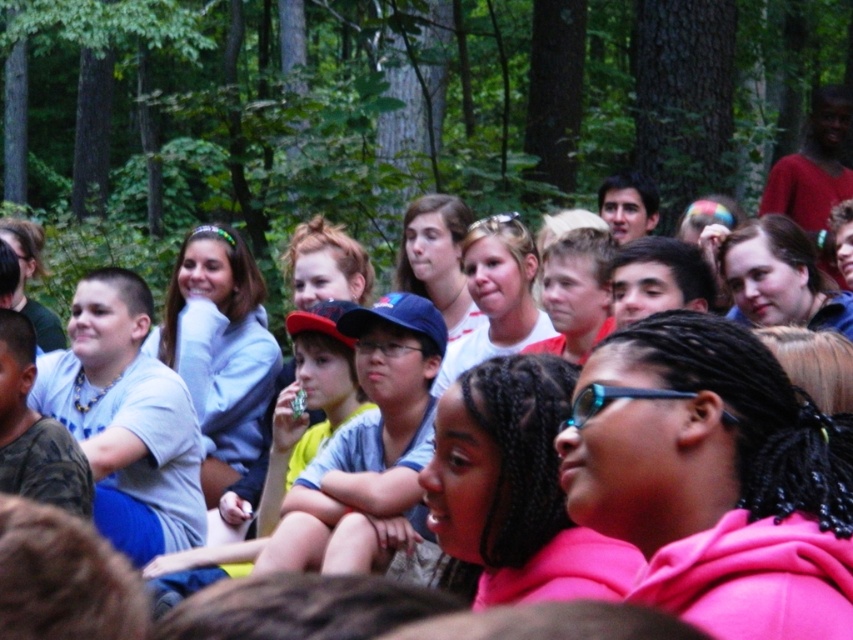
Between blue fabric cap at center and blue plastic goggles at center, which one has less height?

blue plastic goggles at center

Is blue fabric cap at center in front of blue plastic goggles at center?

That is False.

Does point (339, 442) come in front of point (596, 384)?

No, it is not.

Where is `blue fabric cap at center`? The width and height of the screenshot is (853, 640). blue fabric cap at center is located at coordinates (367, 448).